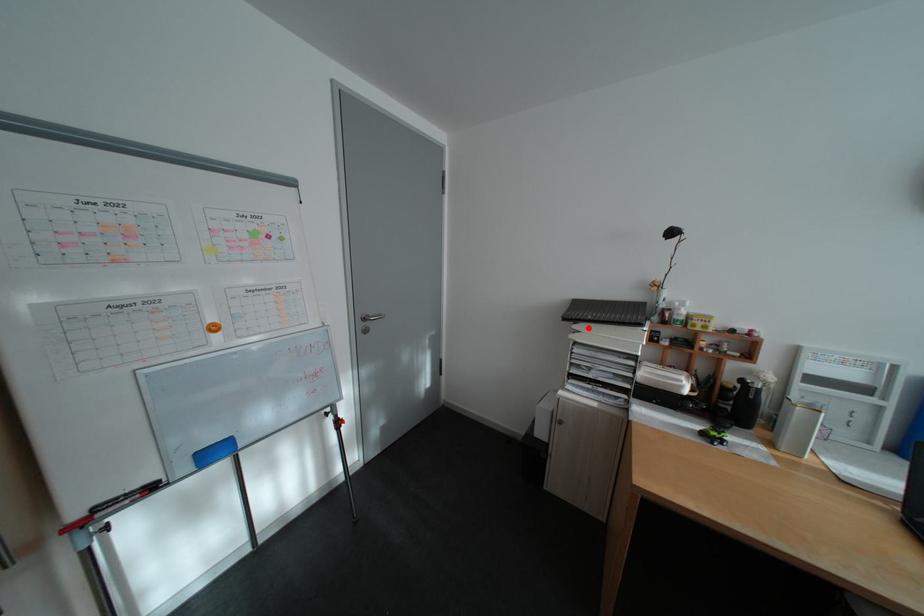
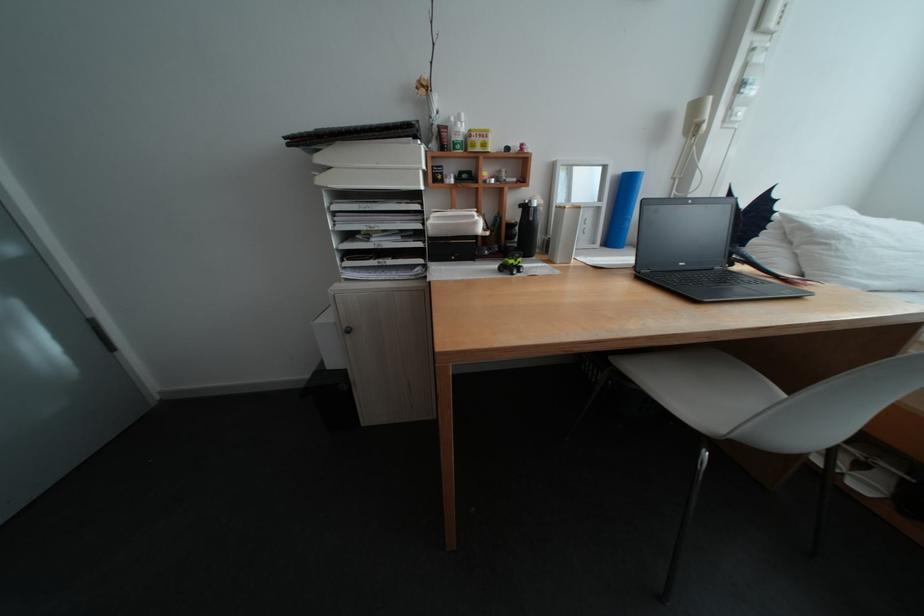
Locate, in the second image, the point that corresponds to the highlighted location in the first image.

(333, 160)